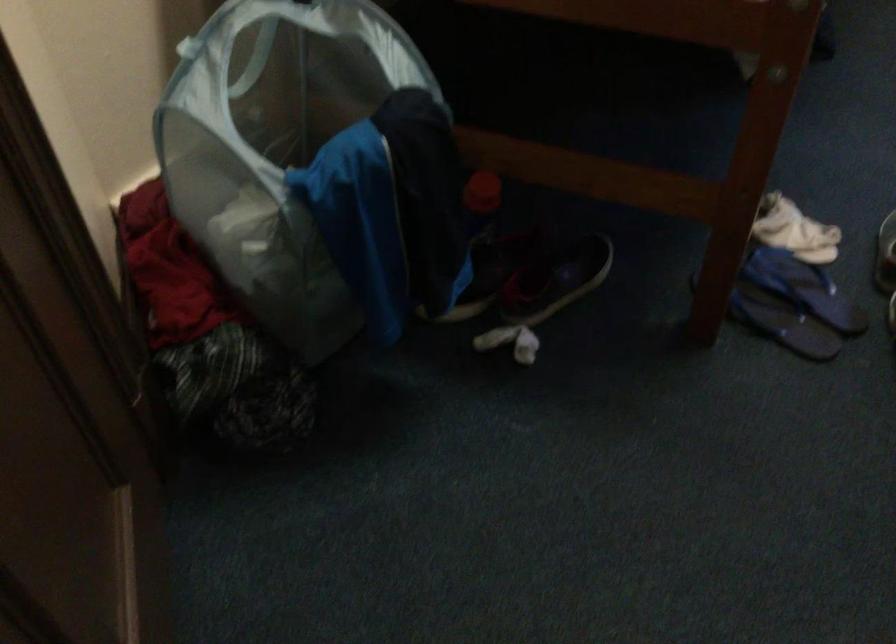
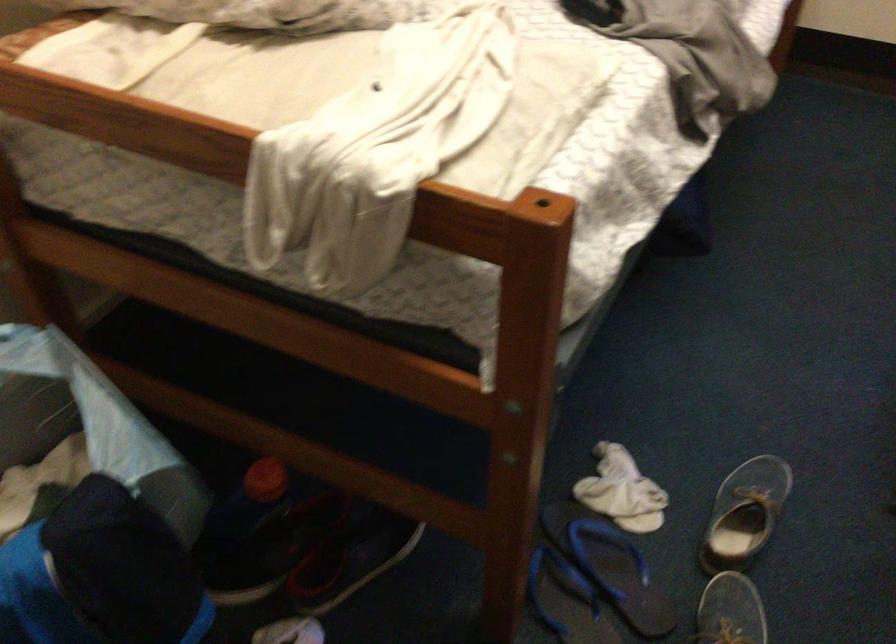
Locate, in the second image, the point that corresponds to (796,230) in the first image.

(622, 491)